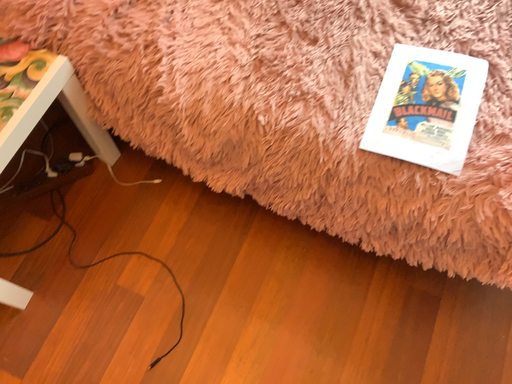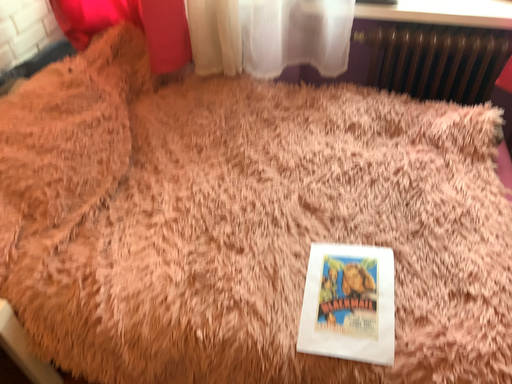
Question: Which way did the camera rotate in the video?

Choices:
 (A) rotated upward
 (B) rotated downward

Answer: (A)